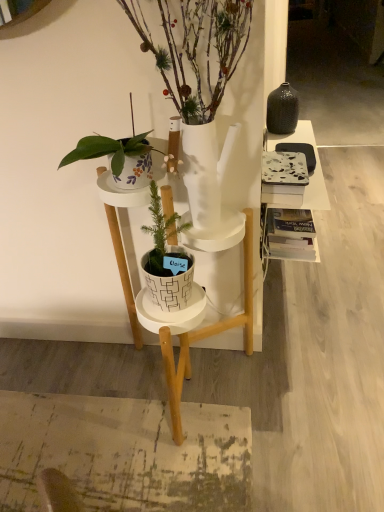
You are a GUI agent. You are given a task and a screenshot of the screen. Output one action in this format:
    pyautogui.click(x=<x>, y=<y>)
    Task: Click on the free spot below white matte plant stand at center (from a real-world perspective)
    
    Given the screenshot: What is the action you would take?
    pyautogui.click(x=189, y=395)